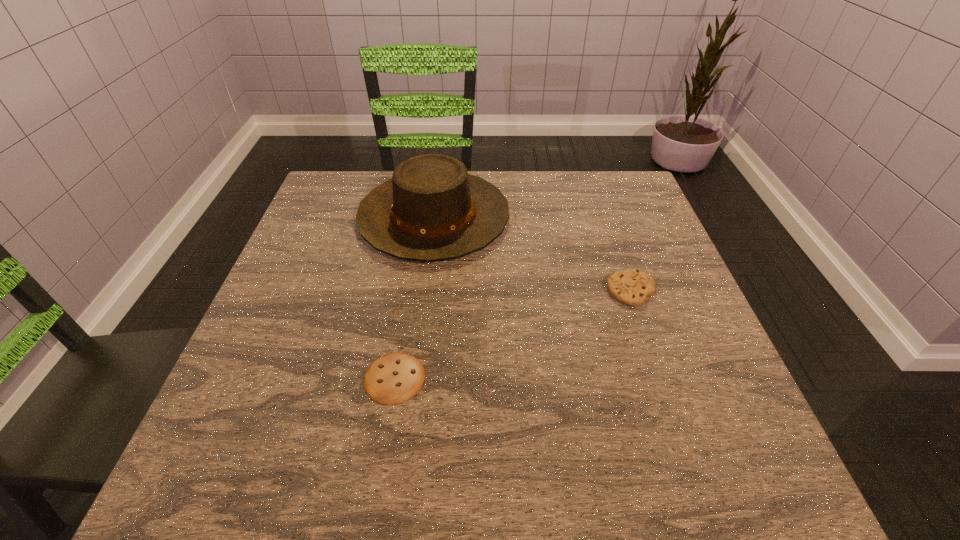
The height and width of the screenshot is (540, 960). What are the coordinates of `the farthest object` in the screenshot? It's located at (431, 209).

I want to click on the tallest object, so click(x=431, y=209).

Locate an element on the screen. The height and width of the screenshot is (540, 960). the second farthest object is located at coordinates (632, 287).

Locate an element on the screen. This screenshot has width=960, height=540. the farther cookie is located at coordinates (632, 287).

Identify the location of the shorter cookie. point(394,378).

Where is `the shortest object`? The width and height of the screenshot is (960, 540). the shortest object is located at coordinates (394, 378).

Where is `vacant space located 0.070m on the front of the tallest object`? The width and height of the screenshot is (960, 540). vacant space located 0.070m on the front of the tallest object is located at coordinates tap(424, 291).

Identify the location of free space located 0.300m on the back of the taller cookie. (599, 198).

Where is `vacant space located 0.340m on the right of the left cookie`? The width and height of the screenshot is (960, 540). vacant space located 0.340m on the right of the left cookie is located at coordinates (616, 378).

Image resolution: width=960 pixels, height=540 pixels. What are the coordinates of `object situated at the far edge` in the screenshot? It's located at (431, 209).